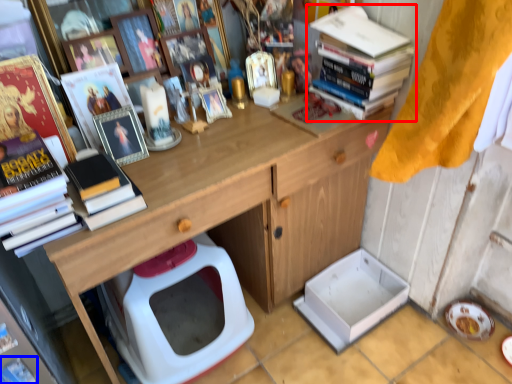
Question: Which of the following is the closest to the observer, book (highlighted by a red box) or magazine (highlighted by a blue box)?

Choices:
 (A) book
 (B) magazine

Answer: (B)